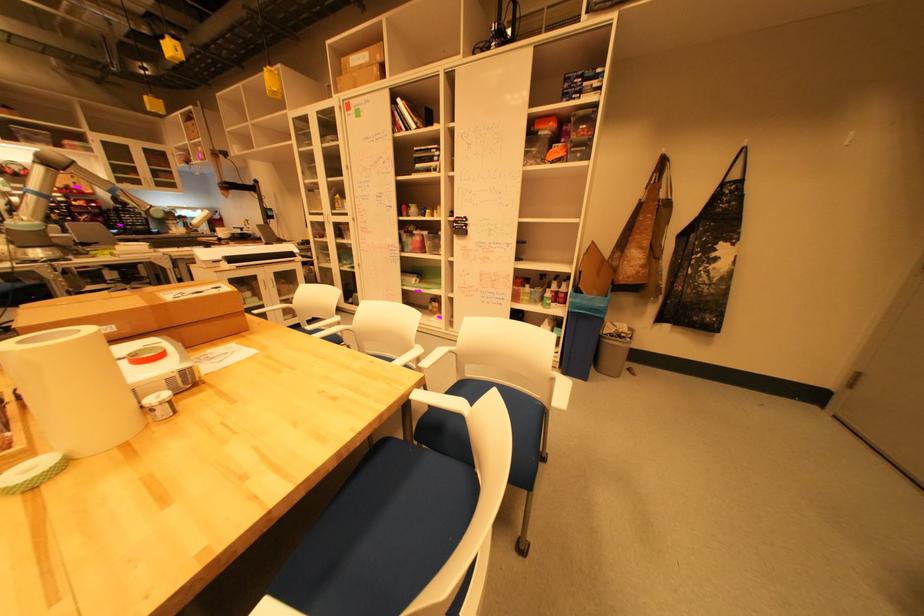
The location [144,313] corresponds to which object?

It refers to a large cardboard box.